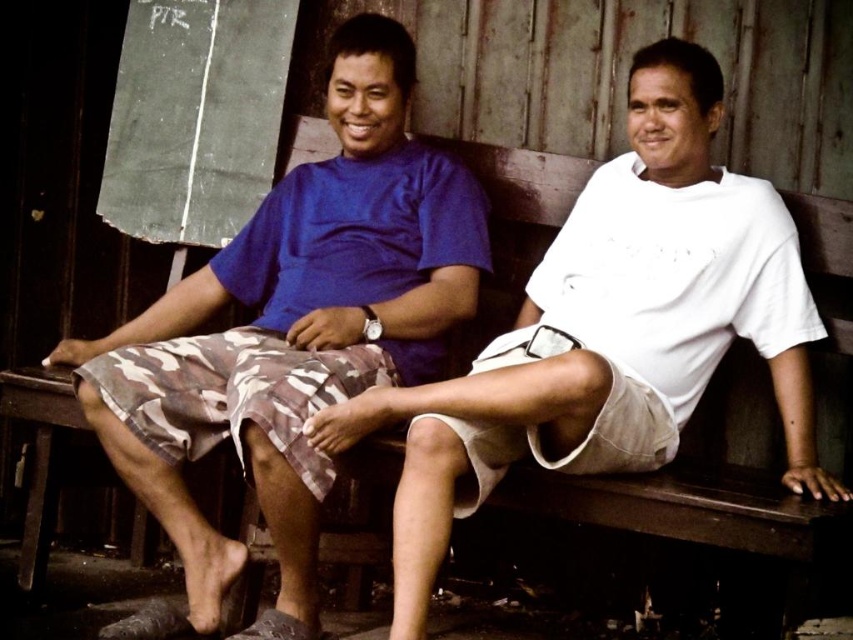
Who is taller, matte blue t-shirt at center or matte blue shirt at center?

Standing taller between the two is matte blue t-shirt at center.

Is point (387, 275) more distant than point (717, 74)?

Yes, it is.

Identify the location of matte blue t-shirt at center. The height and width of the screenshot is (640, 853). (293, 328).